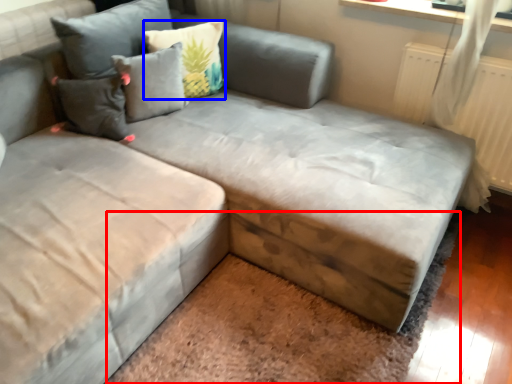
Question: Which point is closer to the camera, mat (highlighted by a red box) or pillow (highlighted by a blue box)?

Choices:
 (A) mat
 (B) pillow

Answer: (A)